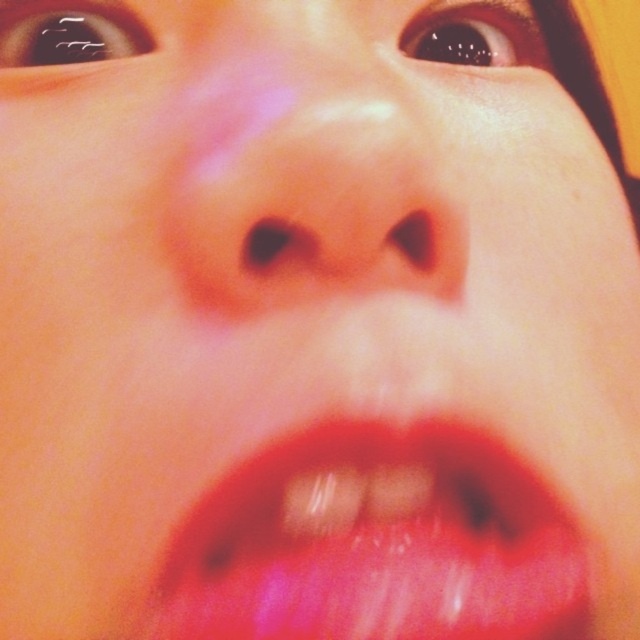
Question: Is shiny red lips at lower center further to camera compared to smooth skin nose at center?

Choices:
 (A) no
 (B) yes

Answer: (A)

Question: Does shiny red lips at lower center appear on the right side of smooth skin nose at center?

Choices:
 (A) no
 (B) yes

Answer: (B)

Question: Which point is closer to the camera?

Choices:
 (A) shiny red lips at lower center
 (B) smooth skin nose at center

Answer: (A)

Question: Which point appears closest to the camera in this image?

Choices:
 (A) (230, 627)
 (B) (376, 65)

Answer: (A)

Question: Is shiny red lips at lower center positioned behind smooth skin nose at center?

Choices:
 (A) yes
 (B) no

Answer: (B)